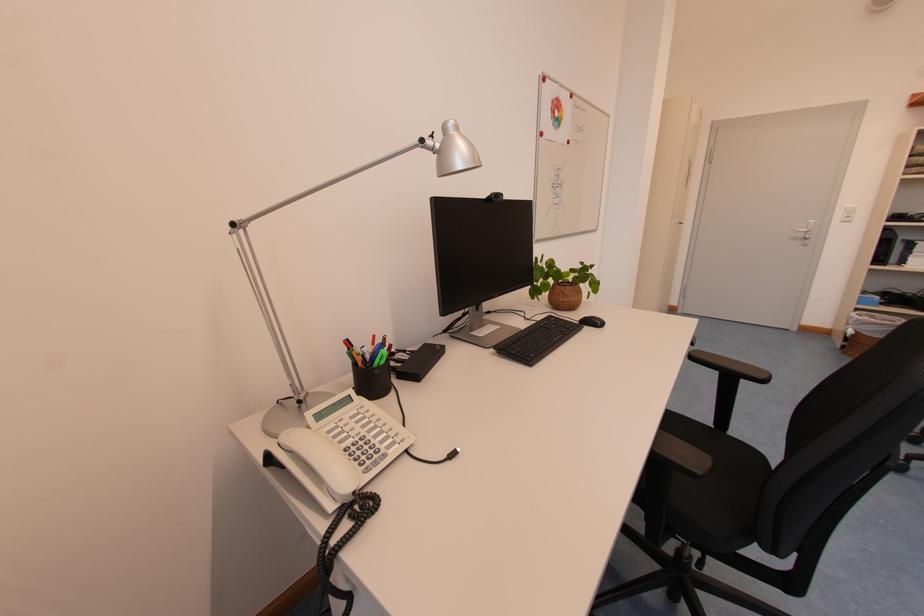
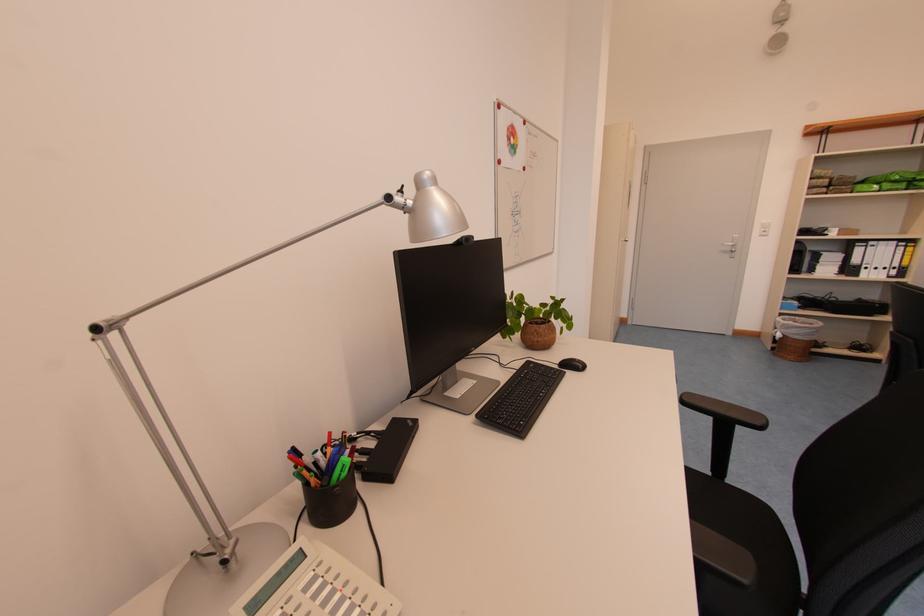
Where in the second image is the point corresponding to the point at 768,379 from the first image?

(766, 426)